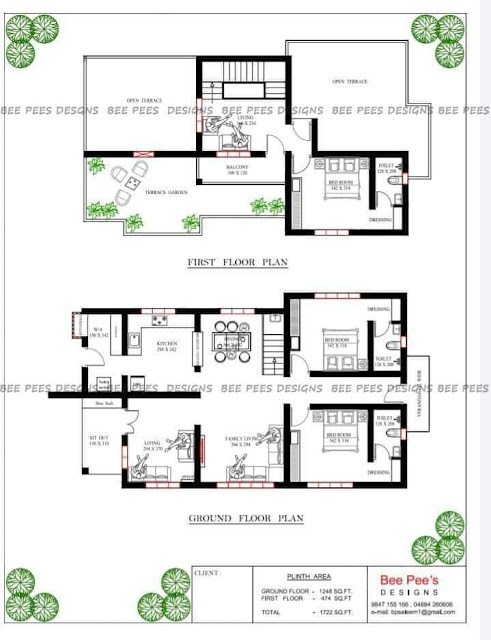
Find the location of `sink`. sink is located at coordinates (136, 340).